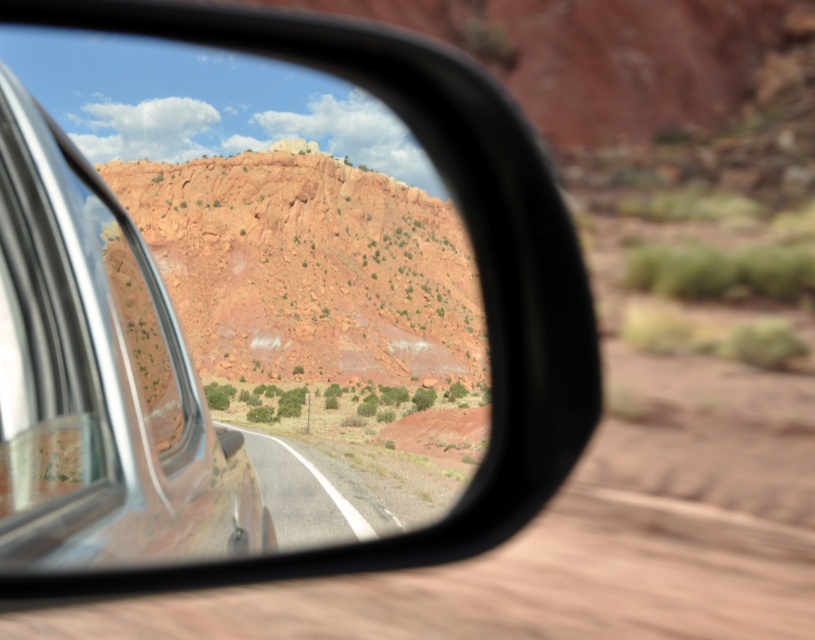
Question: Estimate the real-world distances between objects in this image. Which object is farther from the black glossy mirror at upper left?

Choices:
 (A) brushed metal car window at left
 (B) smooth asphalt road at center

Answer: (B)

Question: Among these points, which one is farthest from the camera?

Choices:
 (A) (353, 474)
 (B) (481, 516)
 (C) (119, 504)

Answer: (A)

Question: Is black glossy mirror at upper left to the left of smooth asphalt road at center from the viewer's perspective?

Choices:
 (A) yes
 (B) no

Answer: (B)

Question: Does black glossy mirror at upper left appear on the right side of smooth asphalt road at center?

Choices:
 (A) yes
 (B) no

Answer: (A)

Question: Considering the real-world distances, which object is farthest from the black glossy mirror at upper left?

Choices:
 (A) brushed metal car window at left
 (B) smooth asphalt road at center

Answer: (B)

Question: Does black glossy mirror at upper left appear on the right side of brushed metal car window at left?

Choices:
 (A) no
 (B) yes

Answer: (B)